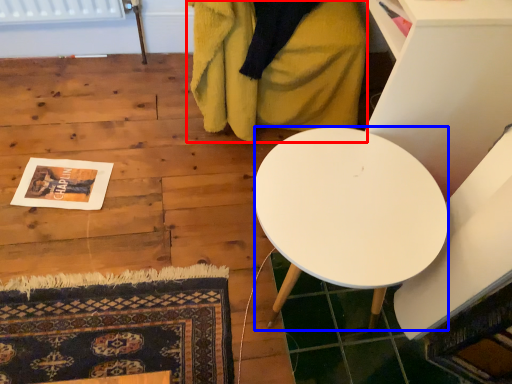
Question: Which point is further to the camera, blanket (highlighted by a red box) or desk (highlighted by a blue box)?

Choices:
 (A) blanket
 (B) desk

Answer: (A)